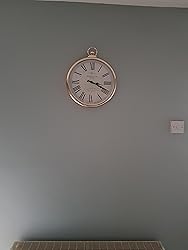
At what (x,y) coordinates should I click in order to perform the action: click on wall fitting. Please return your answer as a coordinate pair (x, y). Looking at the image, I should click on (94, 55).